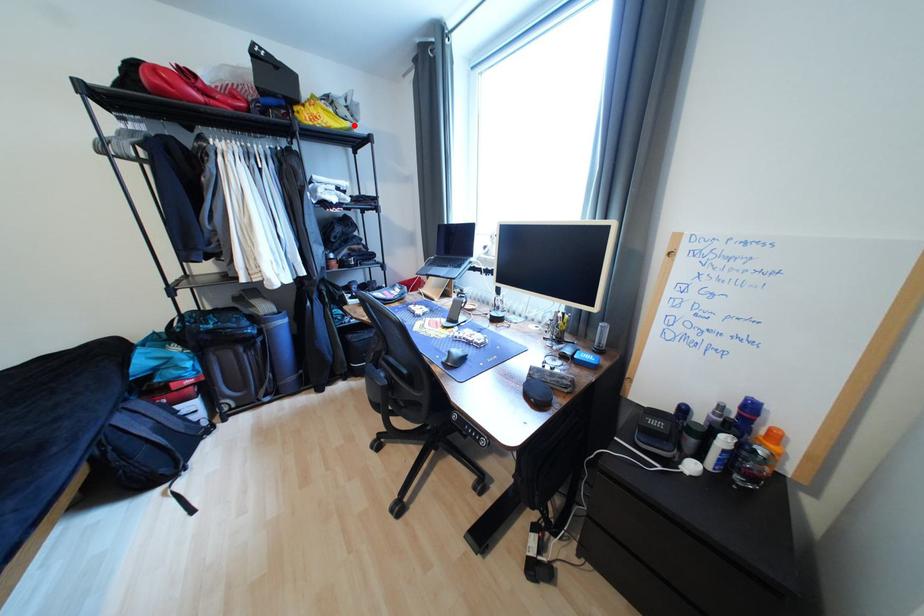
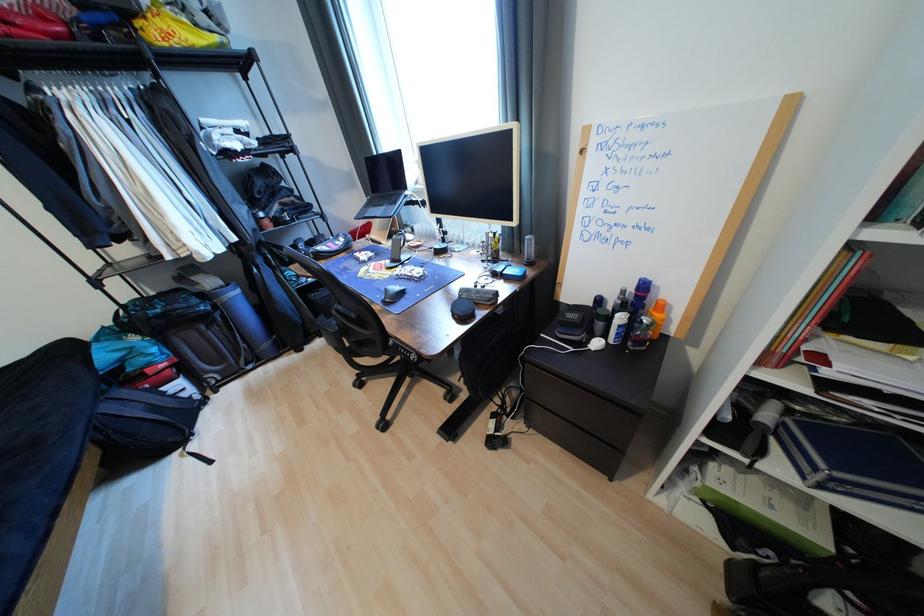
The point at the highlighted location is marked in the first image. Where is the corresponding point in the second image?

(223, 39)